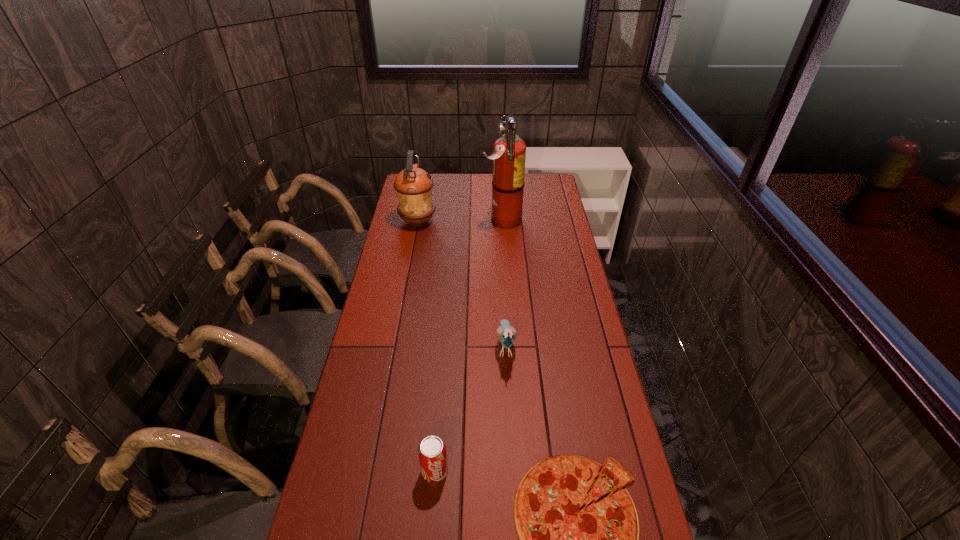
Where is `fire extinguisher`? fire extinguisher is located at coordinates (509, 151).

At what (x,y) coordinates should I click in order to perform the action: click on the leftmost object. Please return your answer as a coordinate pair (x, y). The width and height of the screenshot is (960, 540). Looking at the image, I should click on (413, 185).

You are a GUI agent. You are given a task and a screenshot of the screen. Output one action in this format:
    pyautogui.click(x=<x>, y=<y>)
    Task: Click on the fourth shortest object
    This screenshot has width=960, height=540.
    Given the screenshot: What is the action you would take?
    pyautogui.click(x=413, y=185)

The height and width of the screenshot is (540, 960). What are the coordinates of `bird` in the screenshot? It's located at (506, 334).

At what (x,y) coordinates should I click in order to perform the action: click on the third nearest object. Please return your answer as a coordinate pair (x, y). The height and width of the screenshot is (540, 960). Looking at the image, I should click on (506, 334).

The image size is (960, 540). Find the location of `the second shortest object`. the second shortest object is located at coordinates (432, 454).

Where is `soda can`? The height and width of the screenshot is (540, 960). soda can is located at coordinates (432, 454).

Find the location of `vacant area located 0.170m from the nozzle of the fire extinguisher`. vacant area located 0.170m from the nozzle of the fire extinguisher is located at coordinates (445, 220).

Locate an element on the screen. This screenshot has width=960, height=540. vacant space situated from the nozzle of the fire extinguisher is located at coordinates (398, 220).

This screenshot has width=960, height=540. I want to click on free location located from the nozzle of the fire extinguisher, so click(430, 220).